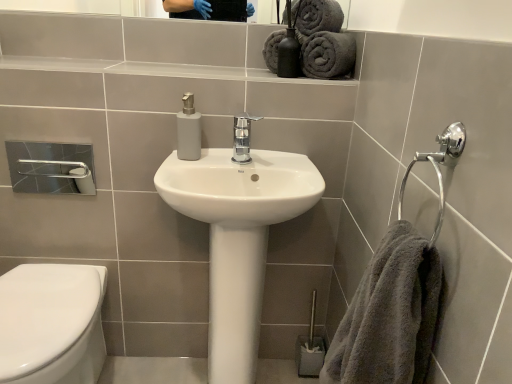
Question: Can you confirm if white glossy sink at center is bigger than dark gray plush towels at upper right, arranged as the second bath towel when viewed from the left?

Choices:
 (A) yes
 (B) no

Answer: (A)

Question: Can you confirm if white glossy sink at center is smaller than dark gray plush towels at upper right, arranged as the second bath towel when viewed from the left?

Choices:
 (A) yes
 (B) no

Answer: (B)

Question: Is white glossy sink at center shorter than dark gray plush towels at upper right, acting as the first bath towel starting from the right?

Choices:
 (A) yes
 (B) no

Answer: (B)

Question: From the image's perspective, is white glossy sink at center above dark gray plush towels at upper right, arranged as the second bath towel when viewed from the left?

Choices:
 (A) no
 (B) yes

Answer: (A)

Question: Is white glossy sink at center closer to camera compared to dark gray plush towels at upper right, acting as the first bath towel starting from the right?

Choices:
 (A) no
 (B) yes

Answer: (B)

Question: Considering the relative positions of white glossy sink at center and dark gray plush towels at upper right, arranged as the second bath towel when viewed from the left, in the image provided, is white glossy sink at center to the left of dark gray plush towels at upper right, arranged as the second bath towel when viewed from the left, from the viewer's perspective?

Choices:
 (A) yes
 (B) no

Answer: (A)

Question: Does white glossy toilet at lower left have a greater width compared to chrome metallic faucet at center?

Choices:
 (A) no
 (B) yes

Answer: (B)

Question: From the image's perspective, is white glossy toilet at lower left over chrome metallic faucet at center?

Choices:
 (A) no
 (B) yes

Answer: (A)

Question: Considering the relative sizes of white glossy toilet at lower left and chrome metallic faucet at center in the image provided, is white glossy toilet at lower left bigger than chrome metallic faucet at center?

Choices:
 (A) yes
 (B) no

Answer: (A)

Question: Is white glossy toilet at lower left positioned before chrome metallic faucet at center?

Choices:
 (A) no
 (B) yes

Answer: (B)

Question: Is white glossy toilet at lower left positioned with its back to chrome metallic faucet at center?

Choices:
 (A) yes
 (B) no

Answer: (B)

Question: Is chrome metallic faucet at center completely or partially inside white glossy toilet at lower left?

Choices:
 (A) no
 (B) yes

Answer: (A)

Question: Is metallic silver toilet brush at lower right at the left side of gray fluffy towel at right?

Choices:
 (A) yes
 (B) no

Answer: (A)